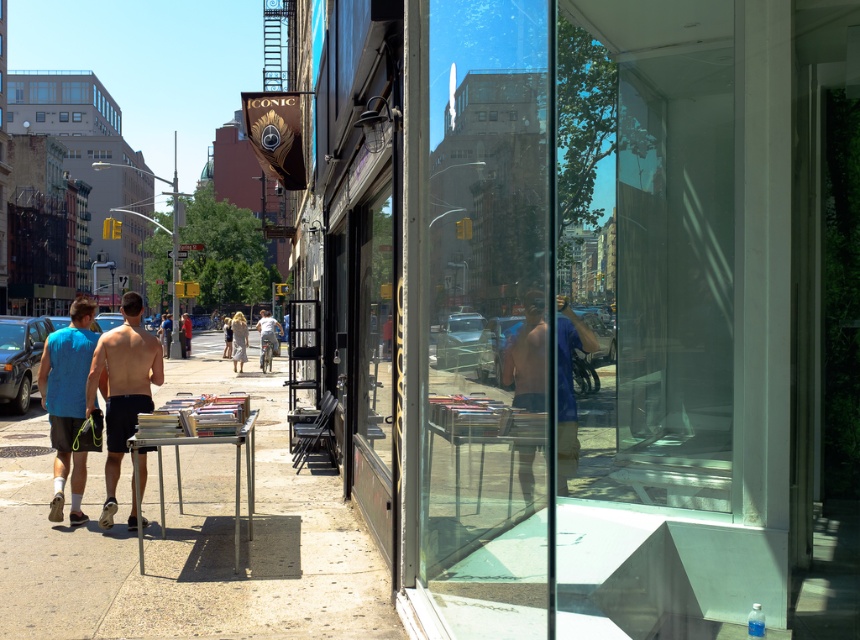
Does shiny black shorts at center have a smaller size compared to light beige fabric dress at center?

No.

Can you confirm if shiny black shorts at center is bigger than light beige fabric dress at center?

Yes, shiny black shorts at center is bigger than light beige fabric dress at center.

What are the coordinates of `shiny black shorts at center` in the screenshot? It's located at (123, 387).

Based on the photo, can you confirm if matte black shorts at center is positioned to the left of light beige fabric dress at center?

Incorrect, matte black shorts at center is not on the left side of light beige fabric dress at center.

Measure the distance between point (533, 356) and camera.

Point (533, 356) and camera are 12.66 feet apart.

Which is in front, point (538, 330) or point (236, 320)?

Point (538, 330) is in front.

This screenshot has width=860, height=640. I want to click on matte black shorts at center, so click(527, 355).

In the scene shown: Does concrete sidewalk at center have a greater width compared to light beige cotton dress at center?

Yes, concrete sidewalk at center is wider than light beige cotton dress at center.

Is point (372, 561) closer to camera compared to point (235, 328)?

Yes, point (372, 561) is closer to viewer.

The image size is (860, 640). Find the location of `concrete sidewalk at center`. concrete sidewalk at center is located at coordinates (189, 536).